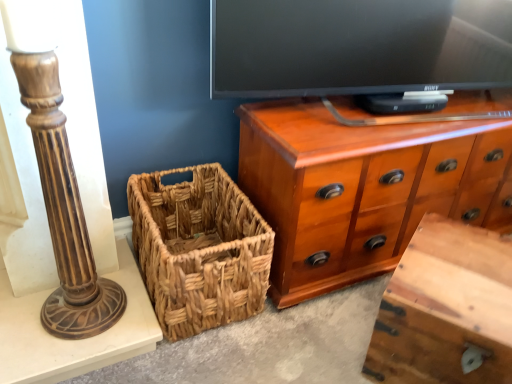
Locate an element on the screen. woven brown picnic basket at lower left is located at coordinates (199, 249).

Is brown polished wood candlestick at left taller than woven brown picnic basket at lower left?

Correct, brown polished wood candlestick at left is much taller as woven brown picnic basket at lower left.

From the image's perspective, which one is positioned lower, brown polished wood candlestick at left or woven brown picnic basket at lower left?

woven brown picnic basket at lower left, from the image's perspective.

From a real-world perspective, is brown polished wood candlestick at left located higher than woven brown picnic basket at lower left?

Correct, in the physical world, brown polished wood candlestick at left is higher than woven brown picnic basket at lower left.

Looking at the image, does wooden vanity at lower right seem bigger or smaller compared to woven brown picnic basket at lower left?

In the image, wooden vanity at lower right appears to be larger than woven brown picnic basket at lower left.

Can you confirm if wooden vanity at lower right is positioned to the right of woven brown picnic basket at lower left?

Yes.

Can you confirm if wooden vanity at lower right is thinner than woven brown picnic basket at lower left?

Correct, the width of wooden vanity at lower right is less than that of woven brown picnic basket at lower left.

How different are the orientations of wooden vanity at lower right and woven brown picnic basket at lower left in degrees?

58.2 degrees.

Is woven brown picnic basket at lower left facing away from shiny brown wood chest of drawers at upper right?

woven brown picnic basket at lower left does not have its back to shiny brown wood chest of drawers at upper right.

How distant is woven brown picnic basket at lower left from shiny brown wood chest of drawers at upper right?

woven brown picnic basket at lower left is 10.28 inches from shiny brown wood chest of drawers at upper right.

Considering the sizes of woven brown picnic basket at lower left and shiny brown wood chest of drawers at upper right in the image, is woven brown picnic basket at lower left wider or thinner than shiny brown wood chest of drawers at upper right?

Clearly, woven brown picnic basket at lower left has more width compared to shiny brown wood chest of drawers at upper right.

Which object is further away from the camera taking this photo, woven brown picnic basket at lower left or shiny brown wood chest of drawers at upper right?

Positioned behind is shiny brown wood chest of drawers at upper right.

Is there a large distance between shiny brown wood chest of drawers at upper right and brown polished wood candlestick at left?

That's not correct — shiny brown wood chest of drawers at upper right is a little close to brown polished wood candlestick at left.

Is shiny brown wood chest of drawers at upper right aimed at brown polished wood candlestick at left?

No, shiny brown wood chest of drawers at upper right is not aimed at brown polished wood candlestick at left.

Is shiny brown wood chest of drawers at upper right at the left side of brown polished wood candlestick at left?

Incorrect, shiny brown wood chest of drawers at upper right is not on the left side of brown polished wood candlestick at left.

Considering the sizes of shiny brown wood chest of drawers at upper right and brown polished wood candlestick at left in the image, is shiny brown wood chest of drawers at upper right wider or thinner than brown polished wood candlestick at left?

Considering their sizes, shiny brown wood chest of drawers at upper right looks broader than brown polished wood candlestick at left.

Locate an element on the screen. The height and width of the screenshot is (384, 512). vanity below the brown polished wood candlestick at left (from a real-world perspective) is located at coordinates (446, 309).

Considering the relative sizes of brown polished wood candlestick at left and wooden vanity at lower right in the image provided, is brown polished wood candlestick at left thinner than wooden vanity at lower right?

Result: Correct, the width of brown polished wood candlestick at left is less than that of wooden vanity at lower right.

Would you consider brown polished wood candlestick at left to be distant from wooden vanity at lower right?

No.

Which is behind, point (48, 173) or point (406, 295)?

The point (406, 295) is more distant.

Considering the relative sizes of shiny brown wood chest of drawers at upper right and woven brown picnic basket at lower left in the image provided, is shiny brown wood chest of drawers at upper right smaller than woven brown picnic basket at lower left?

Actually, shiny brown wood chest of drawers at upper right might be larger than woven brown picnic basket at lower left.

From a real-world perspective, is shiny brown wood chest of drawers at upper right above or below woven brown picnic basket at lower left?

shiny brown wood chest of drawers at upper right is above woven brown picnic basket at lower left.

From the image's perspective, is shiny brown wood chest of drawers at upper right located above woven brown picnic basket at lower left?

Correct, shiny brown wood chest of drawers at upper right appears higher than woven brown picnic basket at lower left in the image.

From the picture: How many degrees apart are the facing directions of shiny brown wood chest of drawers at upper right and woven brown picnic basket at lower left?

The facing directions of shiny brown wood chest of drawers at upper right and woven brown picnic basket at lower left are 0.000195 degrees apart.

Is wooden vanity at lower right outside of brown polished wood candlestick at left?

wooden vanity at lower right lies outside brown polished wood candlestick at left's area.

Could you tell me if wooden vanity at lower right is turned towards brown polished wood candlestick at left?

No, wooden vanity at lower right is not turned towards brown polished wood candlestick at left.

Consider the image. Can you confirm if wooden vanity at lower right is wider than brown polished wood candlestick at left?

Indeed, wooden vanity at lower right has a greater width compared to brown polished wood candlestick at left.

From a real-world perspective, which is physically below, wooden vanity at lower right or brown polished wood candlestick at left?

From a 3D spatial view, wooden vanity at lower right is below.

At what (x,y) coordinates should I click in order to perform the action: click on picnic basket below the brown polished wood candlestick at left (from the image's perspective). Please return your answer as a coordinate pair (x, y). Looking at the image, I should click on (199, 249).

Identify the location of vanity on the right of woven brown picnic basket at lower left. The width and height of the screenshot is (512, 384). (446, 309).

When comparing their distances from woven brown picnic basket at lower left, does brown polished wood candlestick at left or wooden vanity at lower right seem further?

wooden vanity at lower right.

When comparing their distances from shiny brown wood chest of drawers at upper right, does wooden vanity at lower right or woven brown picnic basket at lower left seem further?

The object further to shiny brown wood chest of drawers at upper right is wooden vanity at lower right.

Looking at the image, which one is located further to shiny brown wood chest of drawers at upper right, woven brown picnic basket at lower left or wooden vanity at lower right?

Among the two, wooden vanity at lower right is located further to shiny brown wood chest of drawers at upper right.

From the picture: Looking at the image, which one is located further to brown polished wood candlestick at left, wooden vanity at lower right or woven brown picnic basket at lower left?

wooden vanity at lower right is positioned further to the anchor brown polished wood candlestick at left.

From the picture: Looking at the image, which one is located closer to woven brown picnic basket at lower left, wooden vanity at lower right or shiny brown wood chest of drawers at upper right?

Based on the image, shiny brown wood chest of drawers at upper right appears to be nearer to woven brown picnic basket at lower left.

Based on their spatial positions, is wooden vanity at lower right or shiny brown wood chest of drawers at upper right closer to brown polished wood candlestick at left?

Among the two, shiny brown wood chest of drawers at upper right is located nearer to brown polished wood candlestick at left.

Estimate the real-world distances between objects in this image. Which object is further from brown polished wood candlestick at left, shiny brown wood chest of drawers at upper right or wooden vanity at lower right?

wooden vanity at lower right lies further to brown polished wood candlestick at left than the other object.

Considering their positions, is brown polished wood candlestick at left positioned further to wooden vanity at lower right than woven brown picnic basket at lower left?

The object further to wooden vanity at lower right is brown polished wood candlestick at left.

In order to click on picnic basket between brown polished wood candlestick at left and shiny brown wood chest of drawers at upper right in this screenshot , I will do `click(199, 249)`.

At what (x,y) coordinates should I click in order to perform the action: click on the chest of drawers located between woven brown picnic basket at lower left and wooden vanity at lower right in the left-right direction. Please return your answer as a coordinate pair (x, y). Looking at the image, I should click on (362, 188).

Where is `picnic basket between brown polished wood candlestick at left and wooden vanity at lower right`? picnic basket between brown polished wood candlestick at left and wooden vanity at lower right is located at coordinates (199, 249).

Image resolution: width=512 pixels, height=384 pixels. In order to click on the chest of drawers located between brown polished wood candlestick at left and wooden vanity at lower right in the left-right direction in this screenshot , I will do `click(362, 188)`.